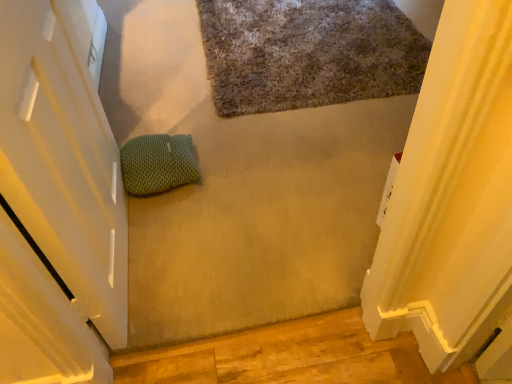
At what (x,y) coordinates should I click in order to perform the action: click on free area in between green mesh pillow at center and textured gray bath mat at upper center. Please return your answer as a coordinate pair (x, y). This screenshot has width=512, height=384. Looking at the image, I should click on (234, 113).